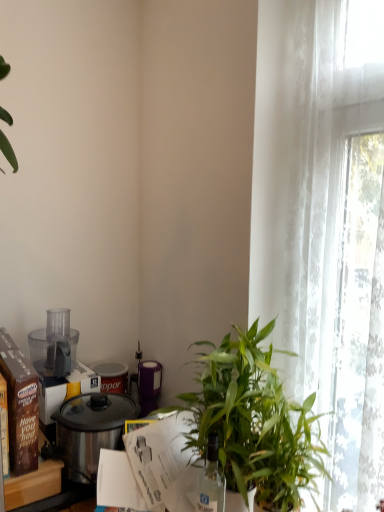
Question: Does brown cardboard box at left appear on the left side of shiny metallic pot at lower left?

Choices:
 (A) no
 (B) yes

Answer: (B)

Question: From a real-world perspective, does brown cardboard box at left stand above shiny metallic pot at lower left?

Choices:
 (A) no
 (B) yes

Answer: (A)

Question: Is brown cardboard box at left to the right of shiny metallic pot at lower left from the viewer's perspective?

Choices:
 (A) no
 (B) yes

Answer: (A)

Question: From the image's perspective, does brown cardboard box at left appear higher than shiny metallic pot at lower left?

Choices:
 (A) yes
 (B) no

Answer: (B)

Question: From the image's perspective, does brown cardboard box at left appear lower than shiny metallic pot at lower left?

Choices:
 (A) yes
 (B) no

Answer: (A)

Question: Do you think matte brown box at left, which appears as the 2th box when viewed from the front, is within shiny metallic pot at lower left, or outside of it?

Choices:
 (A) inside
 (B) outside

Answer: (B)

Question: Is matte brown box at left, which is counted as the first box, starting from the back, in front of or behind shiny metallic pot at lower left in the image?

Choices:
 (A) behind
 (B) front

Answer: (B)

Question: In terms of width, does matte brown box at left, which is counted as the first box, starting from the back, look wider or thinner when compared to shiny metallic pot at lower left?

Choices:
 (A) wide
 (B) thin

Answer: (A)

Question: Visually, is matte brown box at left, which is counted as the first box, starting from the back, positioned to the left or to the right of shiny metallic pot at lower left?

Choices:
 (A) left
 (B) right

Answer: (A)

Question: In terms of width, does shiny metallic pot at lower left look wider or thinner when compared to green leafy plant at center?

Choices:
 (A) thin
 (B) wide

Answer: (A)

Question: From a real-world perspective, is shiny metallic pot at lower left physically located above or below green leafy plant at center?

Choices:
 (A) below
 (B) above

Answer: (A)

Question: In the image, is shiny metallic pot at lower left on the left side or the right side of green leafy plant at center?

Choices:
 (A) left
 (B) right

Answer: (A)

Question: Do you think shiny metallic pot at lower left is within green leafy plant at center, or outside of it?

Choices:
 (A) inside
 (B) outside

Answer: (B)

Question: Does point (54, 345) appear closer or farther from the camera than point (223, 488)?

Choices:
 (A) closer
 (B) farther

Answer: (B)

Question: Is transparent plastic food processor at left taller or shorter than transparent glass bottle at center?

Choices:
 (A) short
 (B) tall

Answer: (A)